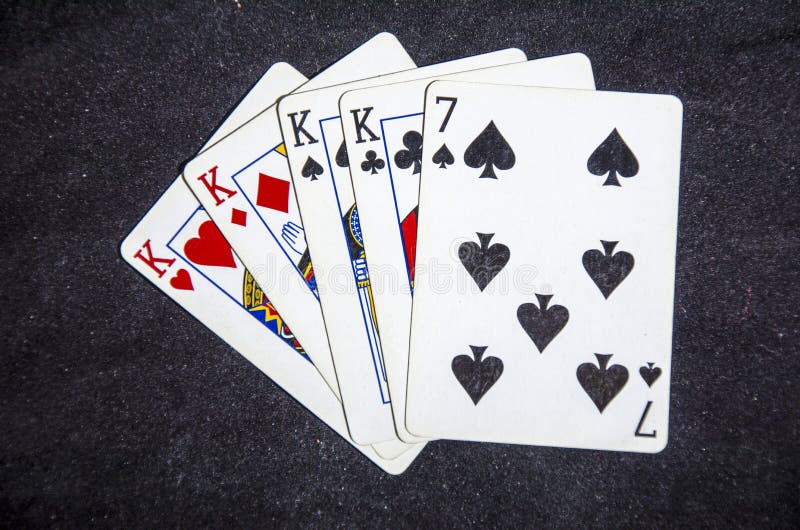
Identify the location of playing cards. (650, 112), (561, 69), (322, 102), (372, 57), (278, 82).